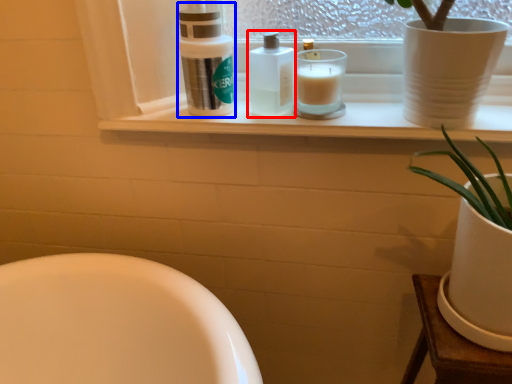
Question: Which of the following is the closest to the observer, toiletry (highlighted by a red box) or cleaning product (highlighted by a blue box)?

Choices:
 (A) toiletry
 (B) cleaning product

Answer: (B)